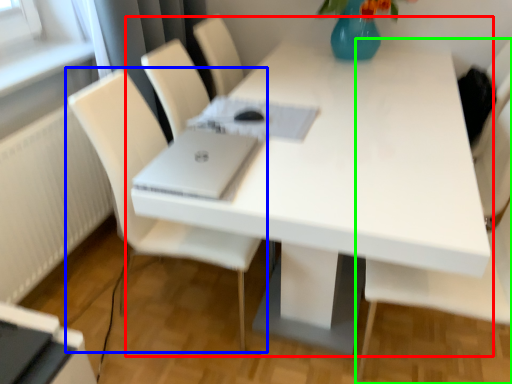
Question: Which object is the closest to the table (highlighted by a red box)? Choose among these: chair (highlighted by a blue box) or chair (highlighted by a green box).

Choices:
 (A) chair
 (B) chair

Answer: (B)